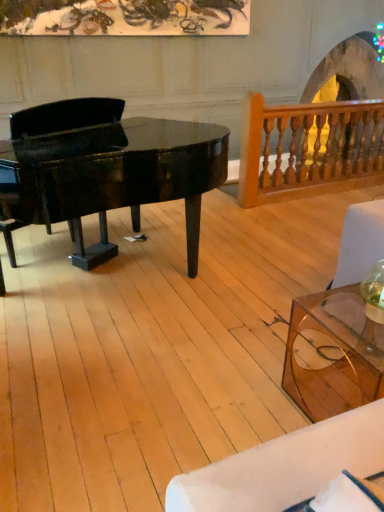
Question: Relative to transparent glass coffee table at lower right, is wooden baluster at upper right in front or behind?

Choices:
 (A) front
 (B) behind

Answer: (B)

Question: From the image's perspective, relative to transparent glass coffee table at lower right, is wooden baluster at upper right above or below?

Choices:
 (A) above
 (B) below

Answer: (A)

Question: Which is nearer to the glossy black piano at left?

Choices:
 (A) transparent glass coffee table at lower right
 (B) wooden baluster at upper right

Answer: (A)

Question: Considering the real-world distances, which object is closest to the glossy black piano at left?

Choices:
 (A) transparent glass coffee table at lower right
 (B) wooden baluster at upper right

Answer: (A)